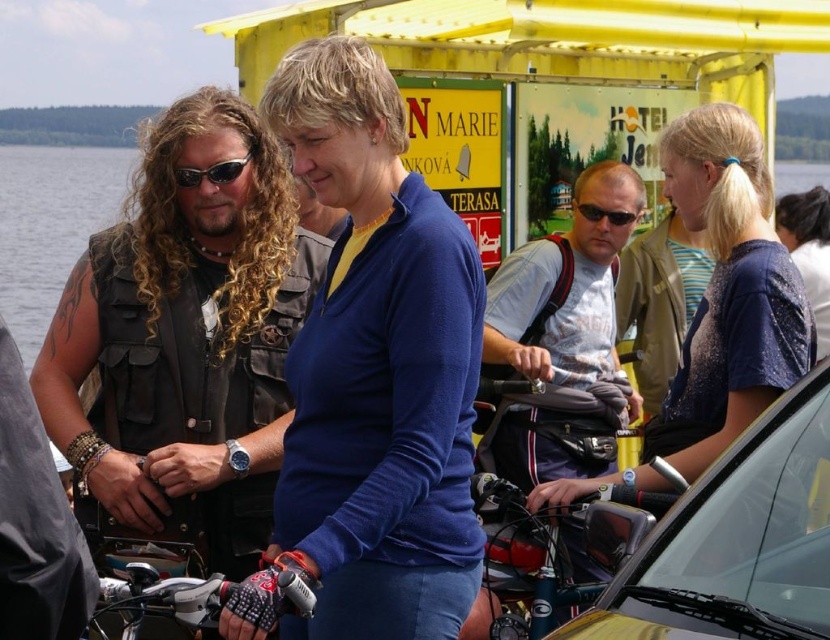
Is leather vest at center thinner than metallic gold car at center?

In fact, leather vest at center might be wider than metallic gold car at center.

Is leather vest at center closer to camera compared to metallic gold car at center?

No, it is not.

Who is more distant from viewer, (77,282) or (716,486)?

The point (77,282) is more distant.

This screenshot has width=830, height=640. In order to click on leather vest at center in this screenshot , I will do `click(184, 342)`.

Which is behind, point (462, 614) or point (648, 557)?

Positioned behind is point (462, 614).

Does blue matte shirt at center have a greater width compared to metallic gold car at center?

In fact, blue matte shirt at center might be narrower than metallic gold car at center.

This screenshot has width=830, height=640. In order to click on blue matte shirt at center in this screenshot , I will do point(372,376).

Where is `blue matte shirt at center`? blue matte shirt at center is located at coordinates (372, 376).

Does blue matte shirt at center appear on the left side of sparkly blue shirt at center?

Yes, blue matte shirt at center is to the left of sparkly blue shirt at center.

Does point (311, 84) come closer to viewer compared to point (687, 387)?

Yes, point (311, 84) is in front of point (687, 387).

Locate an element on the screen. blue matte shirt at center is located at coordinates (372, 376).